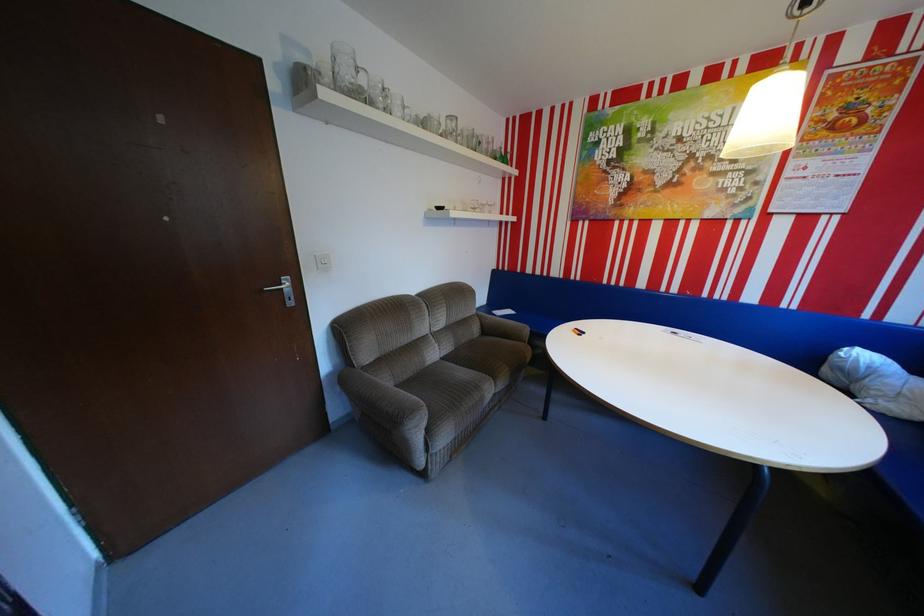
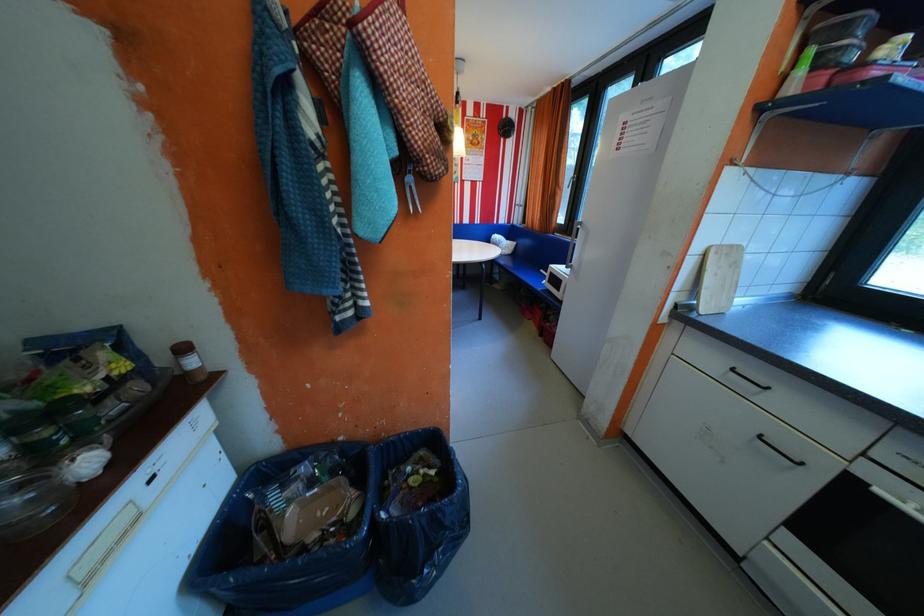
The point at (874, 355) is marked in the first image. Where is the corresponding point in the second image?

(507, 236)